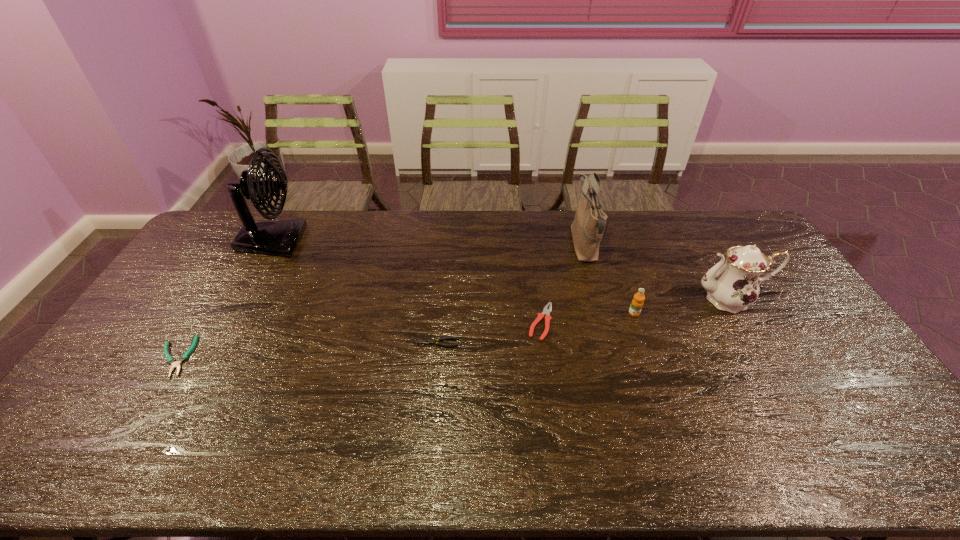
You are a GUI agent. You are given a task and a screenshot of the screen. Output one action in this format:
    pyautogui.click(x=<x>, y=<y>)
    Task: Click on the vacant space that's between the fourth shortest object and the sixth tallest object
    This screenshot has height=540, width=960.
    Given the screenshot: What is the action you would take?
    click(536, 328)

This screenshot has height=540, width=960. I want to click on vacant point located between the fifth shortest object and the fan, so click(x=501, y=270).

The width and height of the screenshot is (960, 540). I want to click on unoccupied area between the leftmost pliers and the tallest pliers, so click(357, 339).

At what (x,y) coordinates should I click in order to perform the action: click on object identified as the fourth closest to the tallest object. Please return your answer as a coordinate pair (x, y). Looking at the image, I should click on (587, 228).

Identify which object is the second nearest to the second pliers from left to right. Please provide its 2D coordinates. Your answer should be formatted as a tuple, i.e. [(x, y)], where the tuple contains the x and y coordinates of a point satisfying the conditions above.

[(587, 228)]

Identify which pliers is the second closest to the second pliers from right to left. Please provide its 2D coordinates. Your answer should be formatted as a tuple, i.e. [(x, y)], where the tuple contains the x and y coordinates of a point satisfying the conditions above.

[(170, 360)]

Choose which pliers is the nearest neighbor to the sixth shortest object. Please provide its 2D coordinates. Your answer should be formatted as a tuple, i.e. [(x, y)], where the tuple contains the x and y coordinates of a point satisfying the conditions above.

[(546, 312)]

Find the location of a particular element. vacant point that satisfies the following two spatial constraints: 1. in front of the fan to blow air; 2. on the back side of the rightmost object is located at coordinates (240, 299).